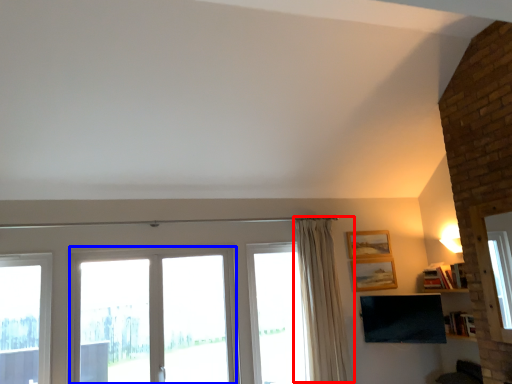
Question: Among these objects, which one is farthest to the camera, curtain (highlighted by a red box) or window (highlighted by a blue box)?

Choices:
 (A) curtain
 (B) window

Answer: (A)